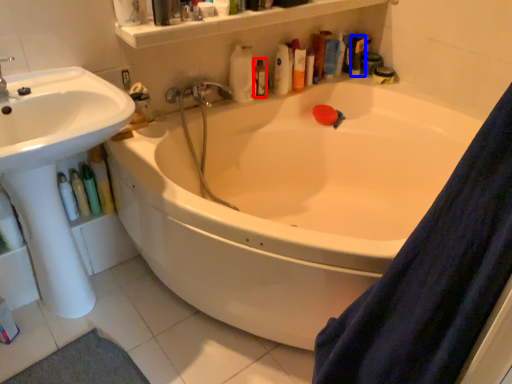
Question: Which of the following is the closest to the observer, toiletry (highlighted by a red box) or toiletry (highlighted by a blue box)?

Choices:
 (A) toiletry
 (B) toiletry

Answer: (A)